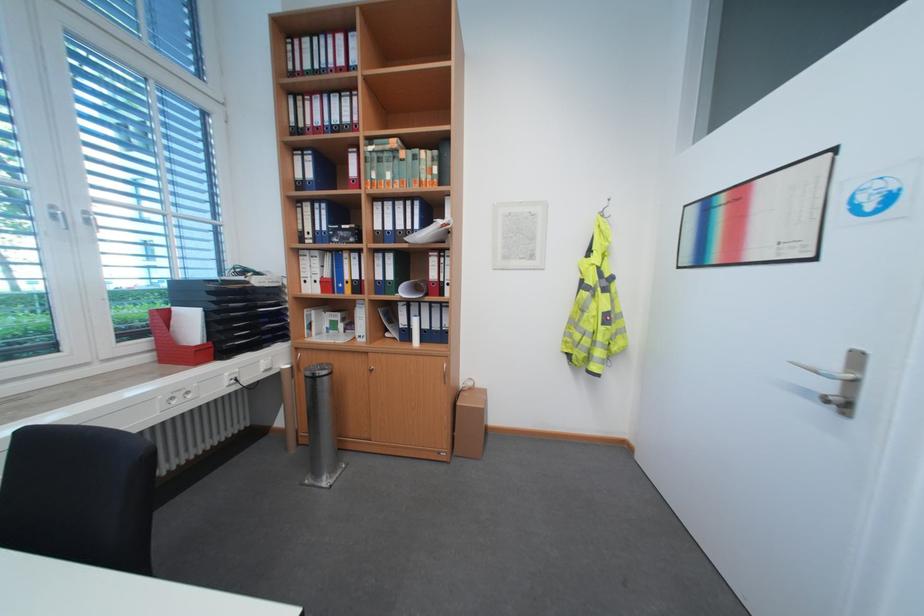
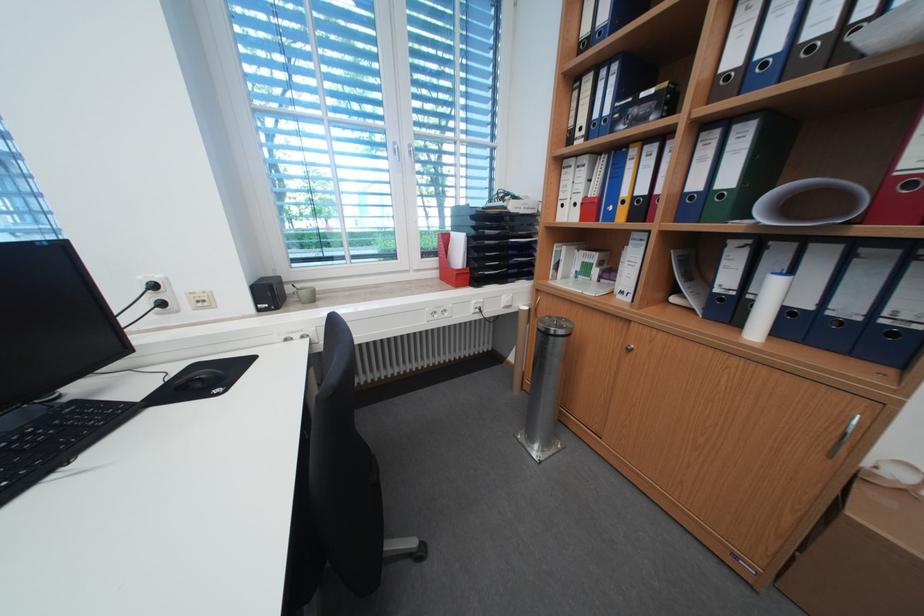
Question: The camera is either moving clockwise (left) or counter-clockwise (right) around the object. The first image is from the beginning of the video and the second image is from the end. Is the camera moving left or right when shooting the video?

Choices:
 (A) Left
 (B) Right

Answer: (B)